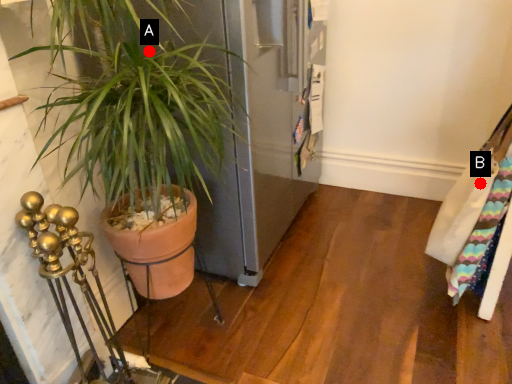
Question: Two points are circled on the image, labeled by A and B beside each circle. Which point is farther from the camera taking this photo?

Choices:
 (A) A is further
 (B) B is further

Answer: (B)